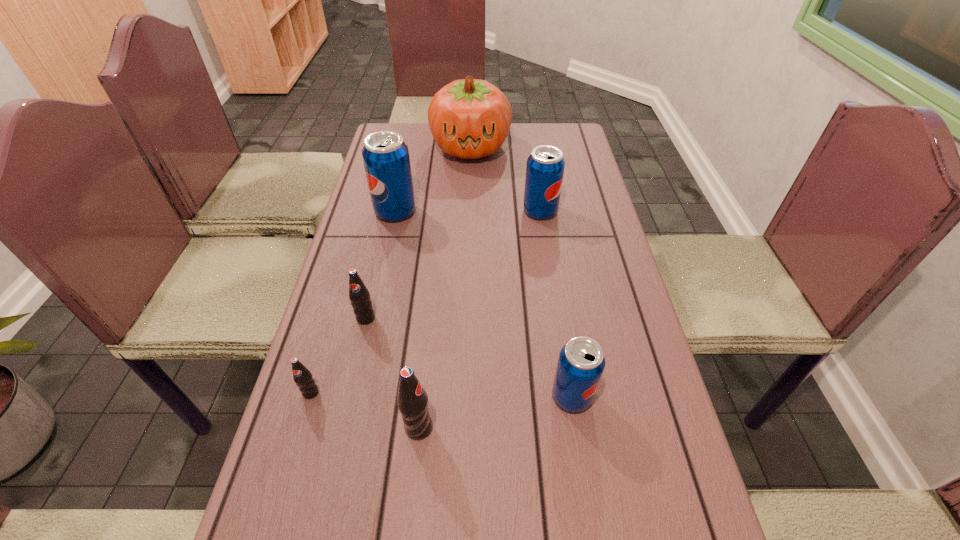
The height and width of the screenshot is (540, 960). Find the location of `pumpkin`. pumpkin is located at coordinates (469, 118).

At what (x,y) coordinates should I click in order to perform the action: click on the farthest object. Please return your answer as a coordinate pair (x, y). This screenshot has height=540, width=960. Looking at the image, I should click on (469, 118).

Identify the location of the leftmost blue pop soda. (385, 155).

You are a GUI agent. You are given a task and a screenshot of the screen. Output one action in this format:
    pyautogui.click(x=<x>, y=<y>)
    Task: Click on the biggest blue pop soda
    This screenshot has width=960, height=540.
    Given the screenshot: What is the action you would take?
    pyautogui.click(x=385, y=155)

Image resolution: width=960 pixels, height=540 pixels. In order to click on the second biggest blue pop soda in this screenshot , I will do `click(545, 166)`.

Find the location of a particular element. the fourth pop from left to right is located at coordinates (412, 400).

Image resolution: width=960 pixels, height=540 pixels. Identify the location of the rightmost black pop. pos(412,400).

The height and width of the screenshot is (540, 960). Find the location of `the smallest blue pop soda`. the smallest blue pop soda is located at coordinates (581, 362).

You are a GUI agent. You are given a task and a screenshot of the screen. Output one action in this format:
    pyautogui.click(x=<x>, y=<y>)
    Task: Click on the second black pop from right to left
    
    Given the screenshot: What is the action you would take?
    pyautogui.click(x=359, y=295)

Identify the location of the fourth nearest pop. The width and height of the screenshot is (960, 540). (359, 295).